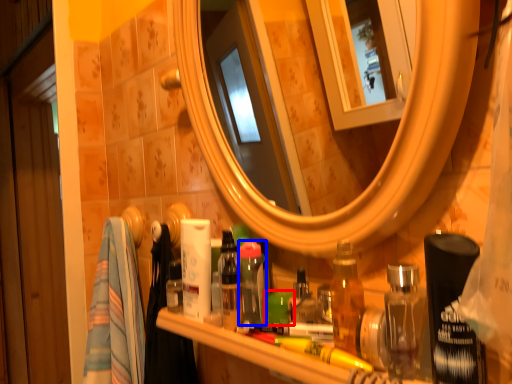
Question: Which point is closer to the camera, toiletry (highlighted by a red box) or toiletry (highlighted by a blue box)?

Choices:
 (A) toiletry
 (B) toiletry

Answer: (A)